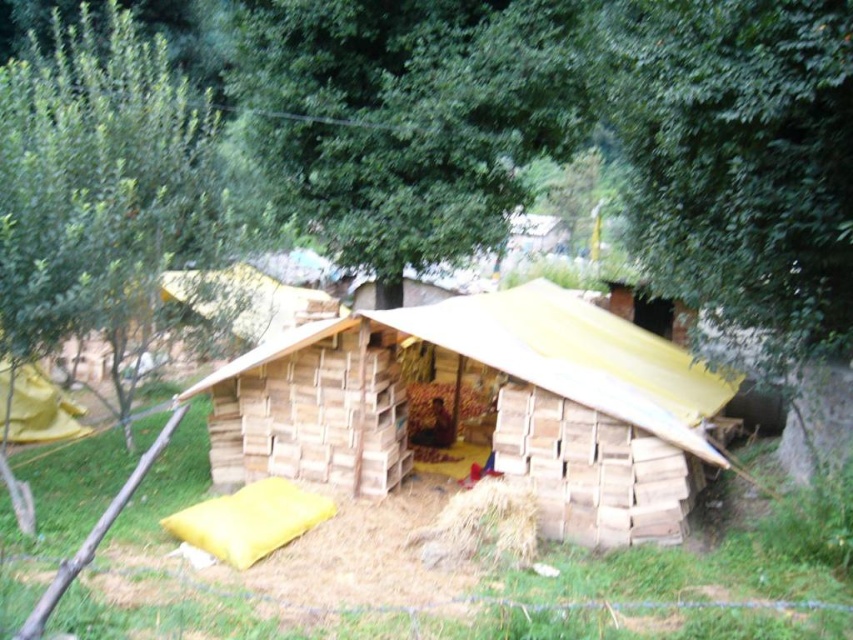
In the scene shown: Is green leafy tree at upper center to the left of brown straw at lower center from the viewer's perspective?

Correct, you'll find green leafy tree at upper center to the left of brown straw at lower center.

Does green leafy tree at upper center have a lesser width compared to brown straw at lower center?

No.

Which is behind, point (357, 77) or point (456, 522)?

Positioned behind is point (357, 77).

The image size is (853, 640). I want to click on green leafy tree at upper center, so click(410, 116).

Does green leafy tree at upper center appear on the right side of green leafy tree at upper left?

Yes, green leafy tree at upper center is to the right of green leafy tree at upper left.

Is point (579, 129) positioned before point (45, 182)?

No, (579, 129) is behind (45, 182).

The height and width of the screenshot is (640, 853). Find the location of `green leafy tree at upper center`. green leafy tree at upper center is located at coordinates (410, 116).

Between point (310, 460) and point (399, 225), which one is positioned in front?

Point (310, 460)

Describe the element at coordinates (496, 410) in the screenshot. I see `wooden hut at center` at that location.

Image resolution: width=853 pixels, height=640 pixels. I want to click on wooden hut at center, so tap(496, 410).